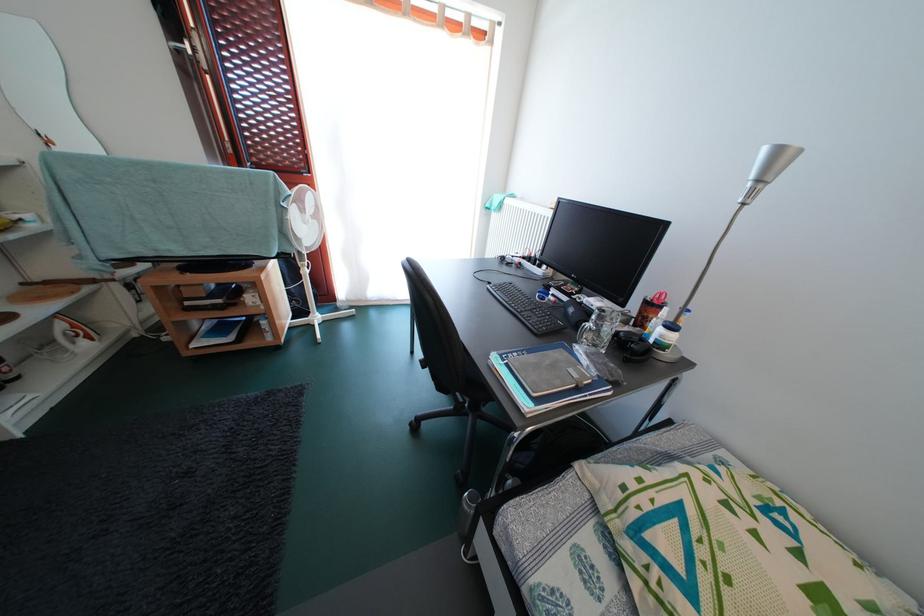
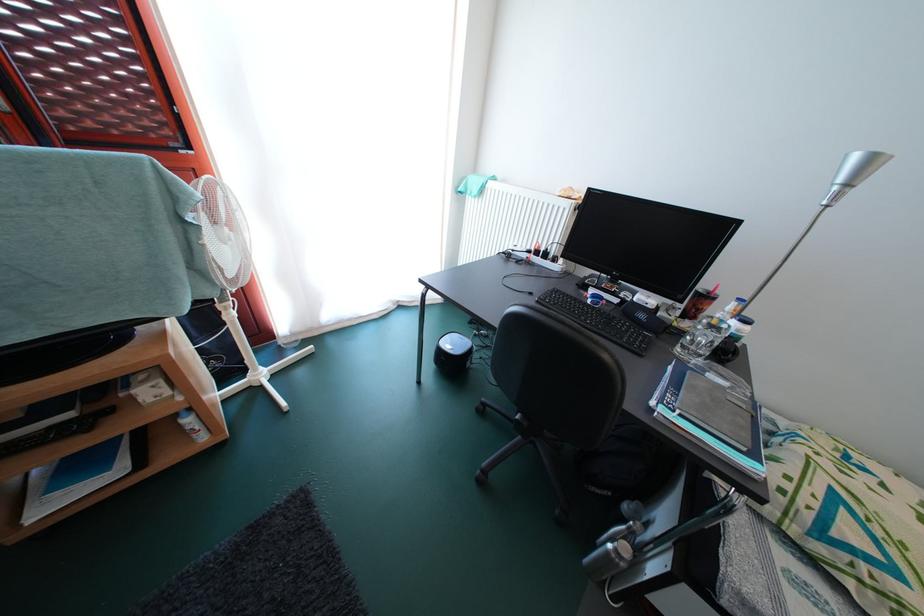
Which direction would the cameraman need to move to produce the second image?

The cameraman moved toward left, forward.